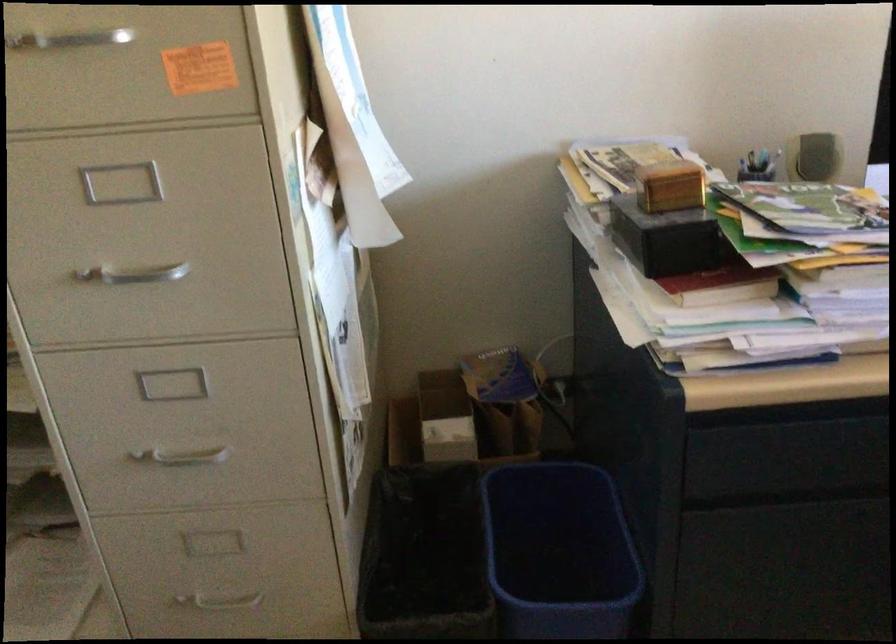
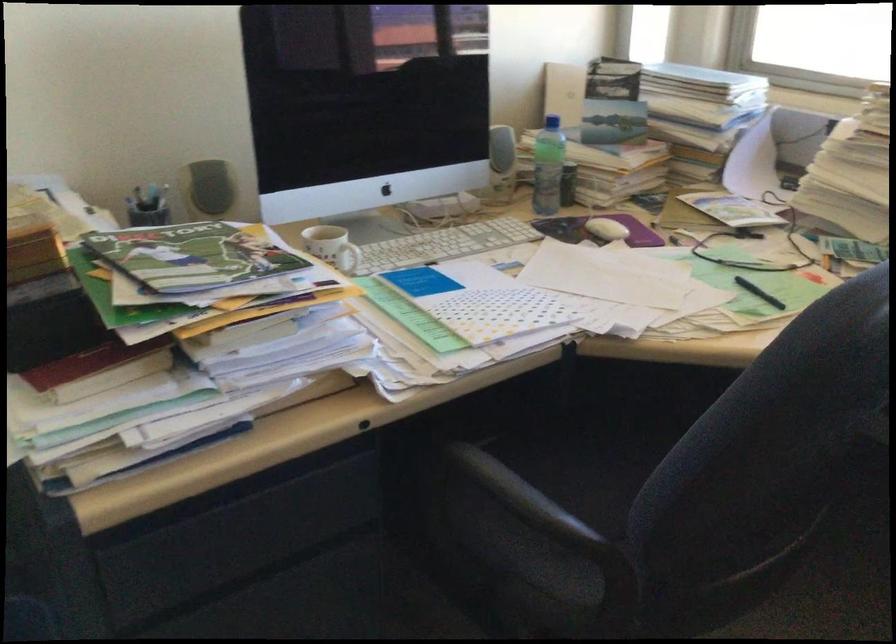
Question: Based on the continuous images, in which direction is the camera rotating? Reply with the corresponding letter.

Choices:
 (A) Left
 (B) Right
 (C) Up
 (D) Down

Answer: (B)